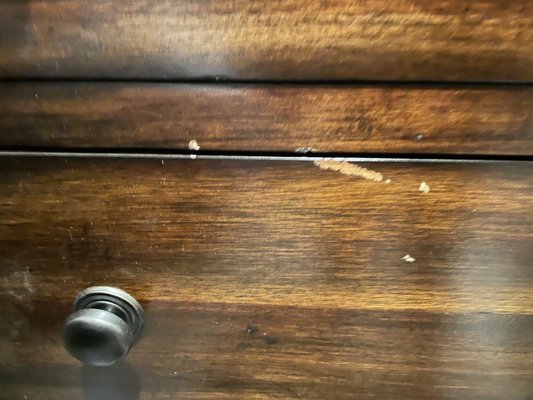
At what (x,y) coordinates should I click in order to perform the action: click on scratch marks in the wood. Please return your answer as a coordinate pair (x, y). The image size is (533, 400). Looking at the image, I should click on (359, 174).